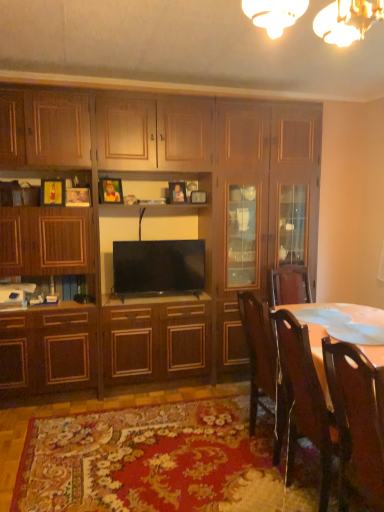
Find the location of a particular element. gold metallic chandelier at upper center is located at coordinates (347, 20).

Where is `flat screen tv at center`? This screenshot has height=512, width=384. flat screen tv at center is located at coordinates (158, 268).

The width and height of the screenshot is (384, 512). I want to click on wooden cabinet at center, so click(x=152, y=223).

Is point (288, 18) less distant than point (328, 442)?

Yes, point (288, 18) is closer to viewer.

Can you confirm if gold metallic chandelier at upper center is positioned to the left of wooden chair at lower right, the second chair when ordered from front to back?

Correct, you'll find gold metallic chandelier at upper center to the left of wooden chair at lower right, the second chair when ordered from front to back.

How many degrees apart are the facing directions of gold metallic chandelier at upper center and wooden chair at lower right, placed as the 1th chair when sorted from back to front?

There is a 180-degree angle between the facing directions of gold metallic chandelier at upper center and wooden chair at lower right, placed as the 1th chair when sorted from back to front.

Considering the sizes of objects gold metallic chandelier at upper center and wooden chair at lower right, placed as the 1th chair when sorted from back to front, in the image provided, who is smaller, gold metallic chandelier at upper center or wooden chair at lower right, placed as the 1th chair when sorted from back to front,?

With smaller size is gold metallic chandelier at upper center.

Considering the positions of objects flat screen tv at center and gold metallic chandelier at upper center in the image provided, who is behind, flat screen tv at center or gold metallic chandelier at upper center?

flat screen tv at center is further away from the camera.

From a real-world perspective, which is physically above, flat screen tv at center or gold metallic chandelier at upper center?

gold metallic chandelier at upper center is physically above.

From the image's perspective, is flat screen tv at center located above or below gold metallic chandelier at upper center?

From the image's perspective, flat screen tv at center appears below gold metallic chandelier at upper center.

Which is more to the left, flat screen tv at center or gold metallic chandelier at upper center?

flat screen tv at center is more to the left.

From the image's perspective, is flat screen tv at center on top of wooden cabinet at center?

Incorrect, from the image's perspective, flat screen tv at center is lower than wooden cabinet at center.

Would you say wooden cabinet at center is part of flat screen tv at center's contents?

Actually, wooden cabinet at center is outside flat screen tv at center.

From a real-world perspective, between flat screen tv at center and wooden cabinet at center, who is vertically higher?

From a 3D spatial view, wooden cabinet at center is above.

Is gold metallic chandelier at upper center oriented towards wooden chair at right, which appears as the second chair when viewed from the back?

No, gold metallic chandelier at upper center is not turned towards wooden chair at right, which appears as the second chair when viewed from the back.

Does point (375, 18) appear closer or farther from the camera than point (351, 423)?

Point (375, 18).

You are a GUI agent. You are given a task and a screenshot of the screen. Output one action in this format:
    pyautogui.click(x=<x>, y=<y>)
    Task: Click on the 2nd chair positioned below the gold metallic chandelier at upper center (from the image's perspective)
    The width and height of the screenshot is (384, 512).
    Given the screenshot: What is the action you would take?
    pyautogui.click(x=357, y=421)

Looking at this image, which is further, (20, 313) or (294, 401)?

The point (20, 313) is more distant.

Identify the location of cabinetry to the left of wooden chair at lower right, placed as the 1th chair when sorted from back to front. (152, 223).

Could you measure the distance between wooden cabinet at center and wooden chair at lower right, placed as the 1th chair when sorted from back to front?

wooden cabinet at center is 1.48 meters away from wooden chair at lower right, placed as the 1th chair when sorted from back to front.

Between wooden cabinet at center and wooden chair at lower right, the second chair when ordered from front to back, which one has smaller width?

With smaller width is wooden cabinet at center.

Who is more distant, wooden cabinet at center or wooden chair at right, which appears as the second chair when viewed from the back?

wooden cabinet at center.

Is wooden cabinet at center looking in the opposite direction of wooden chair at right, which is the first chair in front-to-back order?

No, wooden cabinet at center's orientation is not away from wooden chair at right, which is the first chair in front-to-back order.

Locate an element on the screen. Image resolution: width=384 pixels, height=512 pixels. the 2nd chair below the wooden cabinet at center (from the image's perspective) is located at coordinates (357, 421).

In the scene shown: Looking at their sizes, would you say wooden cabinet at center is wider or thinner than wooden chair at right, which appears as the second chair when viewed from the back?

Clearly, wooden cabinet at center has more width compared to wooden chair at right, which appears as the second chair when viewed from the back.

From the image's perspective, which is below, wooden chair at right, which is the first chair in front-to-back order, or wooden chair at lower right, the second chair when ordered from front to back?

From the image's view, wooden chair at right, which is the first chair in front-to-back order, is below.

The image size is (384, 512). In order to click on chair in front of the wooden chair at lower right, placed as the 1th chair when sorted from back to front in this screenshot , I will do `click(357, 421)`.

Is wooden chair at right, which is the first chair in front-to-back order, outside of wooden chair at lower right, the second chair when ordered from front to back?

Yes, wooden chair at right, which is the first chair in front-to-back order, is outside of wooden chair at lower right, the second chair when ordered from front to back.

Is wooden chair at right, which appears as the second chair when viewed from the back, to the right of wooden chair at lower right, the second chair when ordered from front to back, from the viewer's perspective?

Indeed, wooden chair at right, which appears as the second chair when viewed from the back, is positioned on the right side of wooden chair at lower right, the second chair when ordered from front to back.

The image size is (384, 512). What are the coordinates of `light fixture on the left of the wooden chair at lower right, the second chair when ordered from front to back` in the screenshot? It's located at (347, 20).

At what (x,y) coordinates should I click in order to perform the action: click on television that appears below the gold metallic chandelier at upper center (from the image's perspective). Please return your answer as a coordinate pair (x, y). Image resolution: width=384 pixels, height=512 pixels. Looking at the image, I should click on (158, 268).

Which object lies nearer to the anchor point flat screen tv at center, wooden cabinet at center or wooden chair at lower right, placed as the 1th chair when sorted from back to front?

Among the two, wooden cabinet at center is located nearer to flat screen tv at center.

Based on their spatial positions, is wooden chair at lower right, placed as the 1th chair when sorted from back to front, or wooden chair at right, which is the first chair in front-to-back order, closer to gold metallic chandelier at upper center?

wooden chair at right, which is the first chair in front-to-back order, lies closer to gold metallic chandelier at upper center than the other object.

Which object lies further to the anchor point wooden chair at lower right, placed as the 1th chair when sorted from back to front, gold metallic chandelier at upper center or wooden cabinet at center?

gold metallic chandelier at upper center is further to wooden chair at lower right, placed as the 1th chair when sorted from back to front.

Looking at the image, which one is located further to flat screen tv at center, wooden chair at right, which is the first chair in front-to-back order, or gold metallic chandelier at upper center?

gold metallic chandelier at upper center lies further to flat screen tv at center than the other object.

Consider the image. Based on their spatial positions, is wooden chair at lower right, placed as the 1th chair when sorted from back to front, or flat screen tv at center closer to wooden cabinet at center?

Among the two, flat screen tv at center is located nearer to wooden cabinet at center.

When comparing their distances from wooden chair at lower right, placed as the 1th chair when sorted from back to front, does wooden cabinet at center or flat screen tv at center seem further?

wooden cabinet at center.

Considering their positions, is gold metallic chandelier at upper center positioned closer to flat screen tv at center than wooden chair at lower right, placed as the 1th chair when sorted from back to front?

wooden chair at lower right, placed as the 1th chair when sorted from back to front, is closer to flat screen tv at center.

Consider the image. Considering their positions, is wooden chair at right, which is the first chair in front-to-back order, positioned further to wooden chair at lower right, the second chair when ordered from front to back, than wooden cabinet at center?

Among the two, wooden cabinet at center is located further to wooden chair at lower right, the second chair when ordered from front to back.

You are a GUI agent. You are given a task and a screenshot of the screen. Output one action in this format:
    pyautogui.click(x=<x>, y=<y>)
    Task: Click on the cabinetry between gold metallic chandelier at upper center and flat screen tv at center in the front-back direction
    
    Given the screenshot: What is the action you would take?
    pyautogui.click(x=152, y=223)

Find the location of a particular element. chair between wooden chair at right, which is the first chair in front-to-back order, and flat screen tv at center from front to back is located at coordinates (305, 400).

Locate an element on the screen. The width and height of the screenshot is (384, 512). cabinetry between wooden chair at right, which appears as the second chair when viewed from the back, and flat screen tv at center in the front-back direction is located at coordinates (152, 223).

The height and width of the screenshot is (512, 384). I want to click on chair between gold metallic chandelier at upper center and wooden chair at right, which is the first chair in front-to-back order, vertically, so [305, 400].